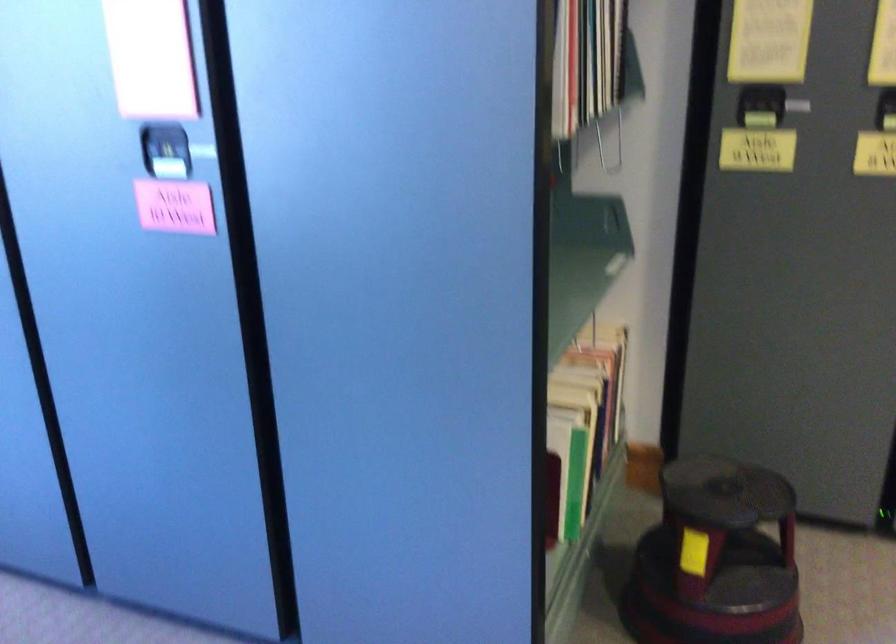
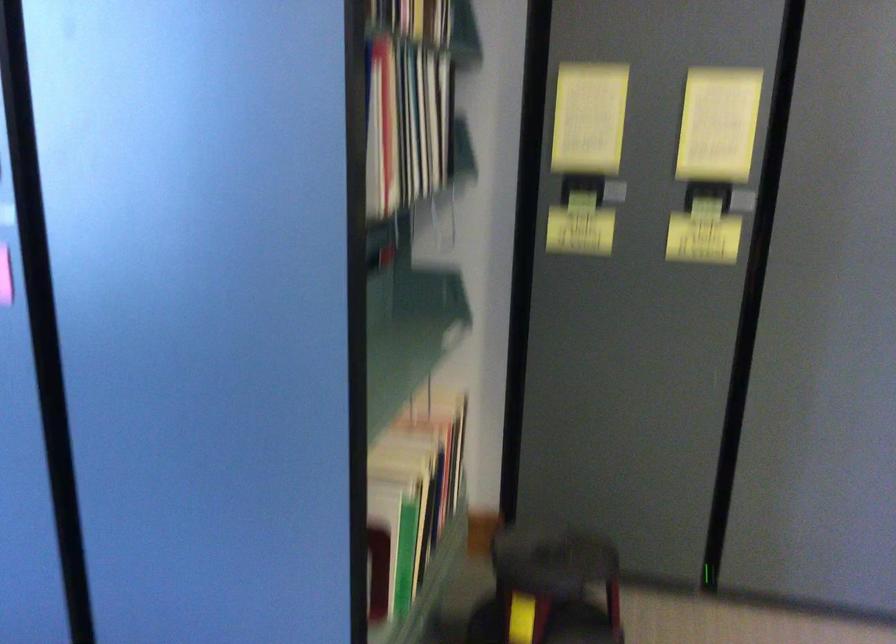
Where in the second image is the point corresponding to pixel 725 488 from the first image?

(552, 558)